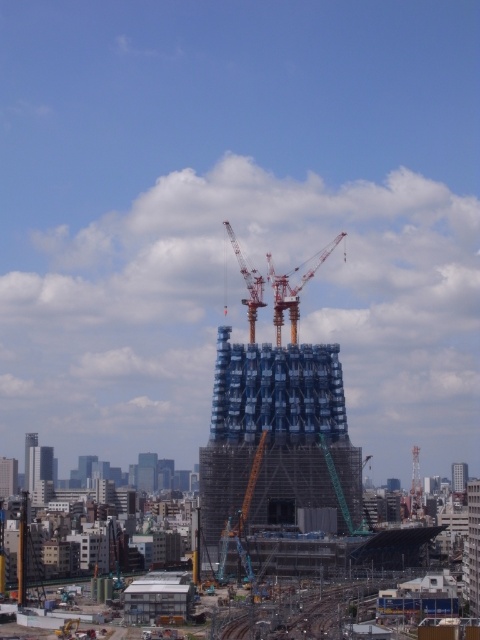
Does scaffolding metal tower at center have a lesser height compared to metal train track at lower center?

In fact, scaffolding metal tower at center may be taller than metal train track at lower center.

What do you see at coordinates (277, 444) in the screenshot? I see `scaffolding metal tower at center` at bounding box center [277, 444].

Who is more forward, (208, 484) or (319, 605)?

Point (319, 605) is in front.

I want to click on scaffolding metal tower at center, so click(277, 444).

Can you confirm if red metal crane at center is positioned above blue glass skyscraper at center?

Correct, red metal crane at center is located above blue glass skyscraper at center.

Which is behind, point (305, 276) or point (456, 467)?

Point (456, 467)

Identify the location of red metal crane at center. (292, 289).

Measure the distance between metal train track at lower center and red metal crane at center.

A distance of 99.51 meters exists between metal train track at lower center and red metal crane at center.

Is metal train track at lower center below red metal crane at center?

Correct, metal train track at lower center is located below red metal crane at center.

Is point (336, 582) farther from camera compared to point (254, 273)?

No.

Identify the location of metal train track at lower center. (301, 611).